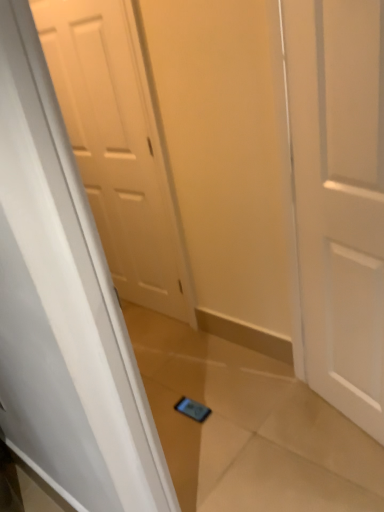
Based on the photo, in order to face white matte door at center, should I rotate leftwards or rightwards?

Rotate your view right by about 19.974°.

Image resolution: width=384 pixels, height=512 pixels. What are the coordinates of `white matte door at center` in the screenshot? It's located at (340, 197).

What do you see at coordinates (340, 197) in the screenshot? I see `white matte door at center` at bounding box center [340, 197].

Find the location of a particular element. The image size is (384, 512). white matte door at center is located at coordinates (340, 197).